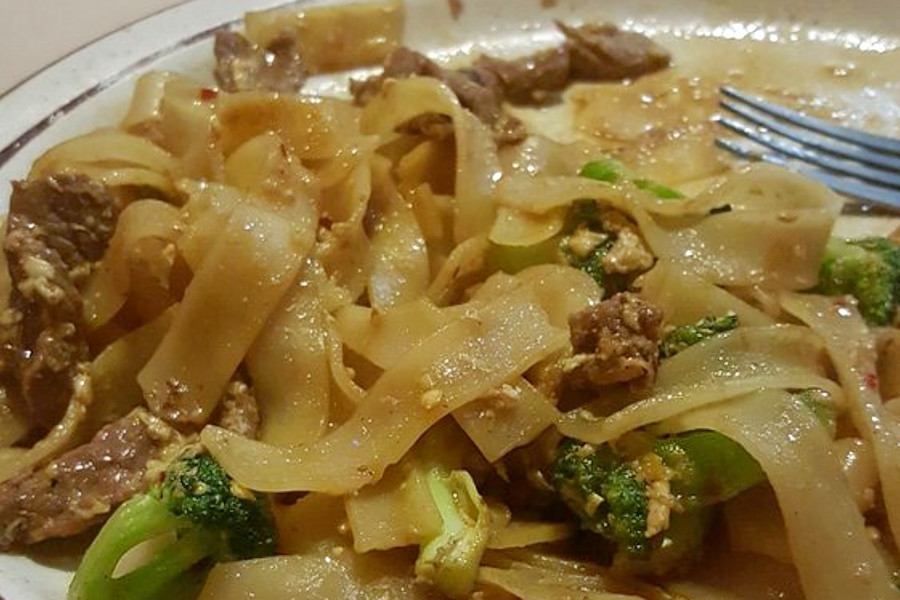
You are a GUI agent. You are given a task and a screenshot of the screen. Output one action in this format:
    pyautogui.click(x=<x>, y=<y>)
    Task: Click on the pointed tines of fork
    This screenshot has width=900, height=600.
    Given the screenshot: What is the action you would take?
    pyautogui.click(x=722, y=87), pyautogui.click(x=720, y=99), pyautogui.click(x=718, y=118), pyautogui.click(x=716, y=141)